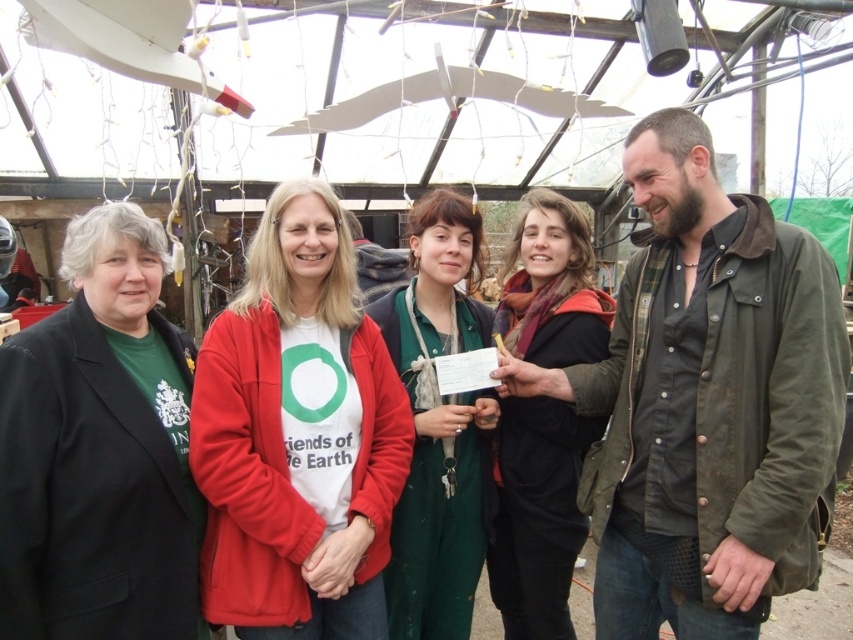
Does olive-green waxed jacket at center-right appear on the right side of green matte dress at center?

Correct, you'll find olive-green waxed jacket at center-right to the right of green matte dress at center.

In order to click on olive-green waxed jacket at center-right in this screenshot , I will do `click(706, 403)`.

Does point (843, 324) come farther from viewer compared to point (465, 618)?

No, it is not.

I want to click on olive-green waxed jacket at center-right, so click(706, 403).

Is point (611, 353) closer to camera compared to point (560, 627)?

Yes, it is.

Who is more distant from viewer, (749, 209) or (560, 337)?

The point (560, 337) is behind.

Who is more forward, (764, 360) or (537, 612)?

Positioned in front is point (764, 360).

You are a GUI agent. You are given a task and a screenshot of the screen. Output one action in this format:
    pyautogui.click(x=<x>, y=<y>)
    Task: Click on the olive-green waxed jacket at center-right
    The width and height of the screenshot is (853, 640).
    Given the screenshot: What is the action you would take?
    pyautogui.click(x=706, y=403)

Is point (489, 520) farther from camera compared to point (564, 340)?

Yes.

Does green matte dress at center have a lesser width compared to black matte scarf at center?

No, green matte dress at center is not thinner than black matte scarf at center.

Where is `green matte dress at center`? This screenshot has height=640, width=853. green matte dress at center is located at coordinates (438, 426).